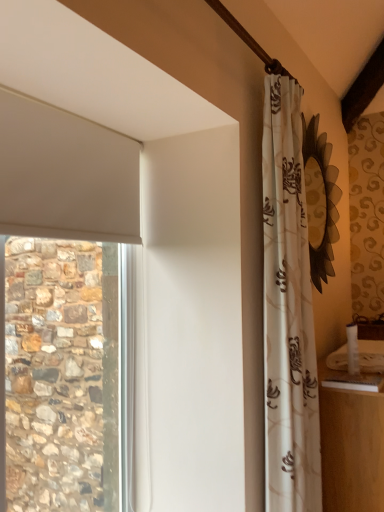
Question: Would you say white glossy counter top at lower right is to the left or to the right of floral-patterned fabric curtain at right in the picture?

Choices:
 (A) left
 (B) right

Answer: (B)

Question: From the image's perspective, is white glossy counter top at lower right positioned above or below floral-patterned fabric curtain at right?

Choices:
 (A) below
 (B) above

Answer: (A)

Question: Based on their sizes in the image, would you say white glossy counter top at lower right is bigger or smaller than floral-patterned fabric curtain at right?

Choices:
 (A) big
 (B) small

Answer: (B)

Question: From a real-world perspective, is floral-patterned fabric curtain at right above or below white glossy counter top at lower right?

Choices:
 (A) below
 (B) above

Answer: (B)

Question: Considering the positions of floral-patterned fabric curtain at right and white glossy counter top at lower right in the image, is floral-patterned fabric curtain at right bigger or smaller than white glossy counter top at lower right?

Choices:
 (A) big
 (B) small

Answer: (A)

Question: Is point (292, 346) positioned closer to the camera than point (379, 373)?

Choices:
 (A) farther
 (B) closer

Answer: (B)

Question: Is floral-patterned fabric curtain at right in front of or behind white glossy counter top at lower right in the image?

Choices:
 (A) front
 (B) behind

Answer: (A)